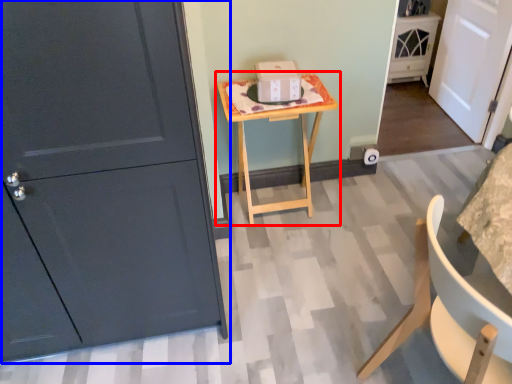
Question: Which object appears farthest to the camera in this image, table (highlighted by a red box) or door (highlighted by a blue box)?

Choices:
 (A) table
 (B) door

Answer: (A)